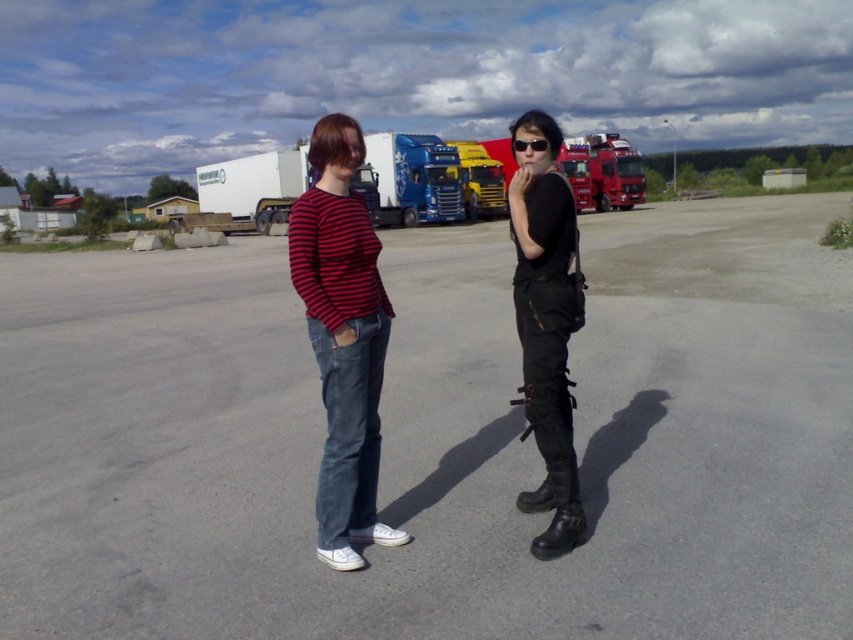
You are a fashion designer observing two people in an outdoor setting. You notice the matte black shirt at center and the black leather boots at center. Which of these two items is shorter in height?

The matte black shirt at center has a lesser height compared to the black leather boots at center, so the matte black shirt at center is shorter in height.

You are designing a new clothing line and want to ensure that the matte black shirt at center and the black leather boots at center can be worn together. Based on their sizes, which item is wider?

The matte black shirt at center is wider than the black leather boots at center because the matte black shirt at center has a greater width according to the description.